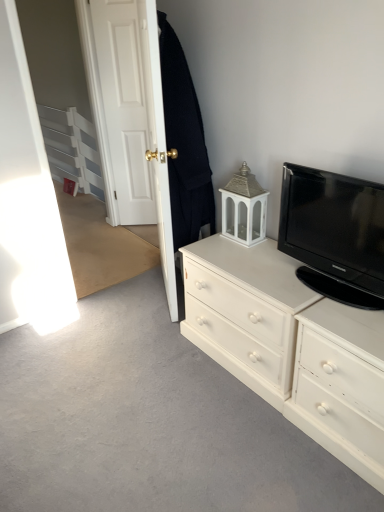
Question: From a real-world perspective, is black woolen robe at upper left on top of white painted wood chest of drawers at right?

Choices:
 (A) yes
 (B) no

Answer: (A)

Question: Is black woolen robe at upper left with white painted wood chest of drawers at right?

Choices:
 (A) no
 (B) yes

Answer: (A)

Question: Is black woolen robe at upper left far away from white painted wood chest of drawers at right?

Choices:
 (A) no
 (B) yes

Answer: (A)

Question: Considering the relative sizes of black woolen robe at upper left and white painted wood chest of drawers at right in the image provided, is black woolen robe at upper left smaller than white painted wood chest of drawers at right?

Choices:
 (A) no
 (B) yes

Answer: (B)

Question: Is black woolen robe at upper left at the left side of white painted wood chest of drawers at right?

Choices:
 (A) no
 (B) yes

Answer: (B)

Question: Looking at their shapes, would you say white painted wood chest of drawers at right is wider or thinner than white wood door at upper left, which appears as the 2th door when viewed from the right?

Choices:
 (A) wide
 (B) thin

Answer: (A)

Question: Is white painted wood chest of drawers at right bigger or smaller than white wood door at upper left, which appears as the 2th door when viewed from the right?

Choices:
 (A) big
 (B) small

Answer: (A)

Question: Is point coord(187,327) closer or farther from the camera than point coord(107,134)?

Choices:
 (A) closer
 (B) farther

Answer: (A)

Question: From the image's perspective, is white painted wood chest of drawers at right located above or below white wood door at upper left, which appears as the 2th door when viewed from the right?

Choices:
 (A) below
 (B) above

Answer: (A)

Question: Based on their sizes in the image, would you say white wooden door at upper left, acting as the second door starting from the left, is bigger or smaller than black glossy tv at upper right?

Choices:
 (A) big
 (B) small

Answer: (A)

Question: From the image's perspective, is white wooden door at upper left, acting as the second door starting from the left, located above or below black glossy tv at upper right?

Choices:
 (A) below
 (B) above

Answer: (B)

Question: From a real-world perspective, is white wooden door at upper left, acting as the second door starting from the left, physically located above or below black glossy tv at upper right?

Choices:
 (A) below
 (B) above

Answer: (B)

Question: Which is correct: white wooden door at upper left, acting as the second door starting from the left, is inside black glossy tv at upper right, or outside of it?

Choices:
 (A) inside
 (B) outside

Answer: (B)

Question: In the image, is white painted wood drawer at right positioned in front of or behind black glossy tv at upper right?

Choices:
 (A) behind
 (B) front

Answer: (B)

Question: Based on their sizes in the image, would you say white painted wood drawer at right is bigger or smaller than black glossy tv at upper right?

Choices:
 (A) big
 (B) small

Answer: (A)